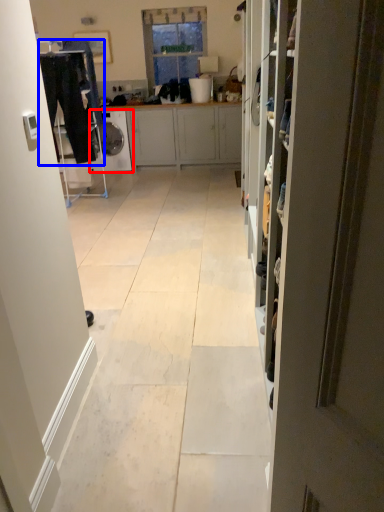
Question: Which object is further to the camera taking this photo, dish washer (highlighted by a red box) or laundry (highlighted by a blue box)?

Choices:
 (A) dish washer
 (B) laundry

Answer: (A)